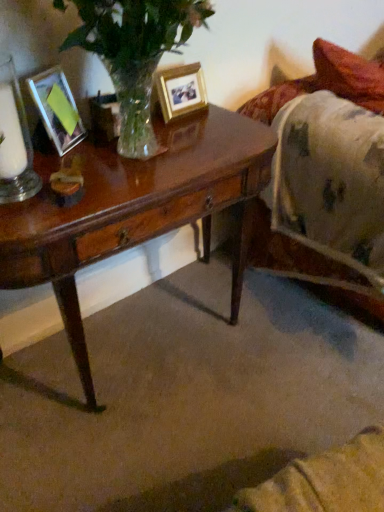
Question: Is matte glass picture frame at left, acting as the second picture frame starting from the back, inside the boundaries of clear glass candle holder at left, or outside?

Choices:
 (A) outside
 (B) inside

Answer: (A)

Question: In terms of width, does matte glass picture frame at left, marked as the first picture frame in a front-to-back arrangement, look wider or thinner when compared to clear glass candle holder at left?

Choices:
 (A) wide
 (B) thin

Answer: (B)

Question: Estimate the real-world distances between objects in this image. Which object is farther from the fluffy white blanket at right?

Choices:
 (A) gold metallic photo frame at upper center, which ranks as the 2th picture frame in left-to-right order
 (B) matte glass picture frame at left, the second picture frame positioned from the right
 (C) shiny brown wood desk at center
 (D) white wax candle at left
 (E) clear glass candle holder at left

Answer: (D)

Question: Which is nearer to the shiny brown wood desk at center?

Choices:
 (A) white wax candle at left
 (B) fluffy white blanket at right
 (C) gold metallic photo frame at upper center, which ranks as the 2th picture frame in left-to-right order
 (D) clear glass candle holder at left
 (E) matte glass picture frame at left, the second picture frame positioned from the right

Answer: (D)